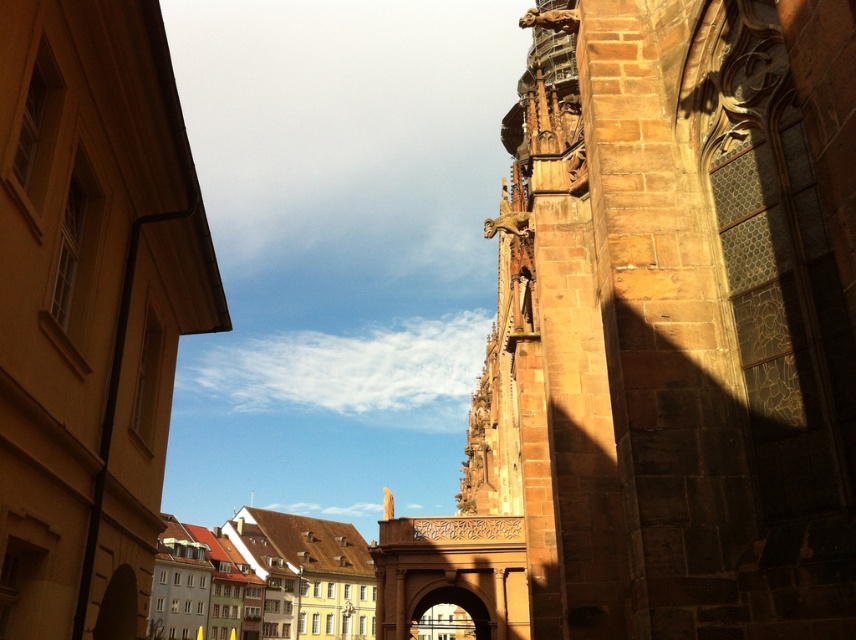
You are a tourist standing in the city square and want to take a photo of the brown stone church at upper left and the light brown stone buildings at center. Which object should you focus on first if you want to capture both in a single frame without moving the camera?

The brown stone church at upper left is positioned over light brown stone buildings at center, so you should focus on the light brown stone buildings at center first to ensure both are in the frame.

You are a tourist standing in the square and want to take a photo of the brown stone tower at upper right and the light brown stone buildings at center. Which one should you point your camera upwards to capture?

You should point your camera upwards to capture the brown stone tower at upper right because it is positioned above the light brown stone buildings at center.

You are an architect analyzing the historic cityscape. You notice the brown stone tower at upper right and the brown stone church at upper left. Which structure has a greater overall size according to the scene?

The brown stone tower at upper right is larger in size than the brown stone church at upper left, so it has a greater overall size.